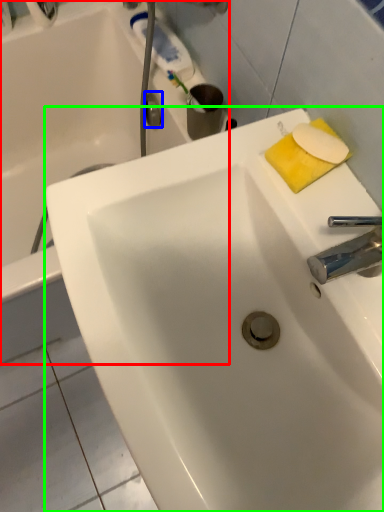
Question: Which object is the closest to the bathtub (highlighted by a red box)? Choose among these: plumbing fixture (highlighted by a blue box) or sink (highlighted by a green box).

Choices:
 (A) plumbing fixture
 (B) sink

Answer: (A)